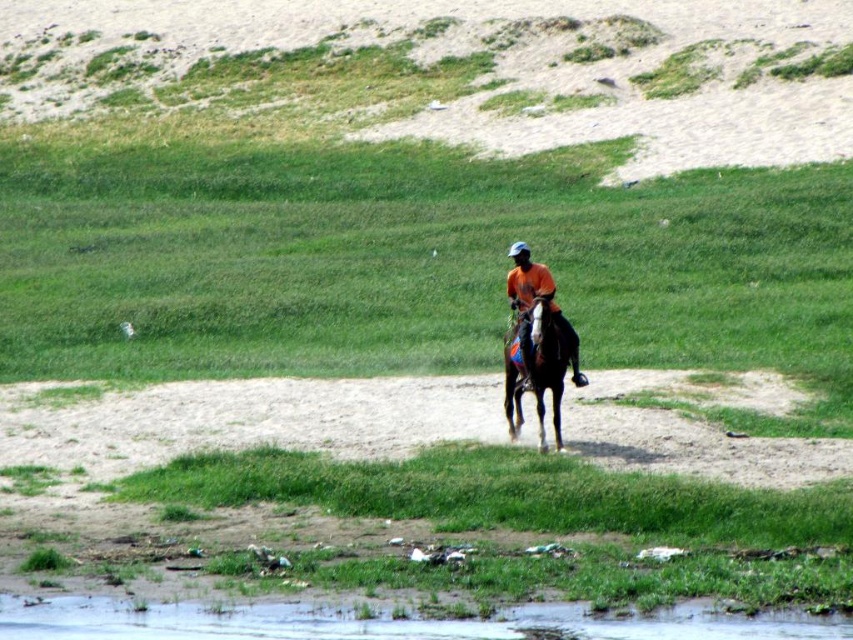
You are a photographer planning to capture a wide shot of the scene. Given that the orange cotton shirt at center and the green grassy field at center are both in the frame, which object occupies more horizontal space in the image?

The green grassy field at center occupies more horizontal space in the image because its width is larger than that of the orange cotton shirt at center.

You are a photographer trying to capture the shiny brown horse at center and the brown sandy ground at lower center in the same frame. Which object is located to the left of the other?

The brown sandy ground at lower center is positioned on the left side of the shiny brown horse at center.